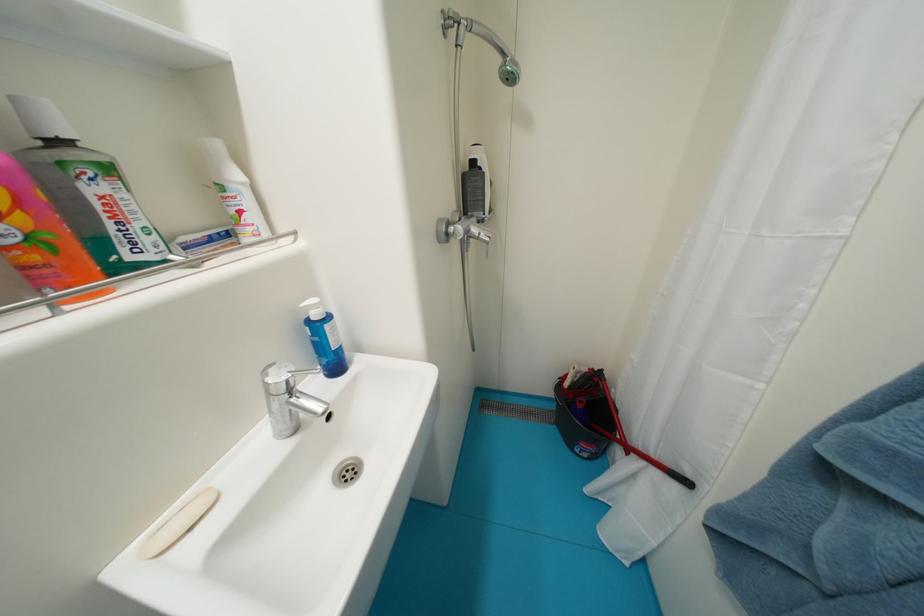
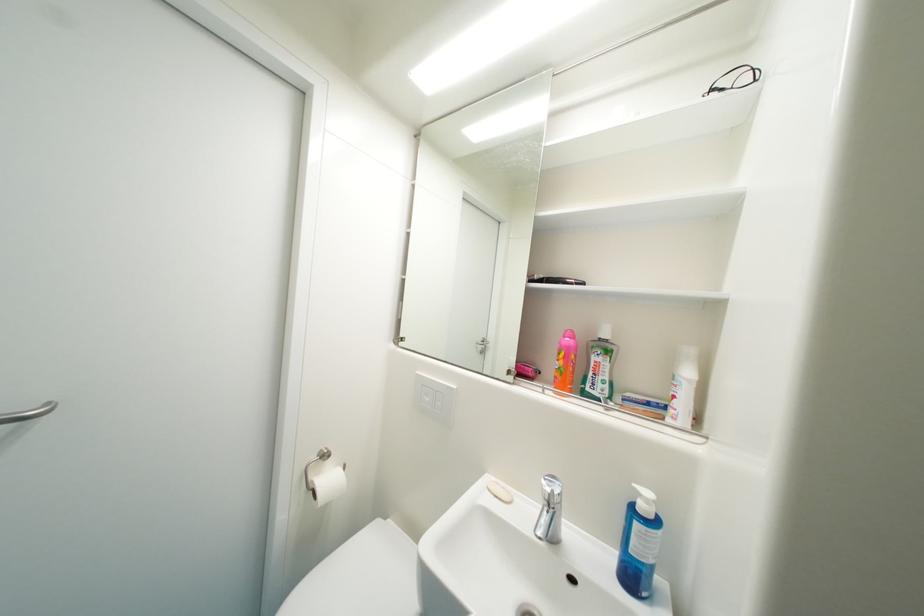
Where in the second image is the point corresponding to point (323, 308) from the first image?

(653, 503)